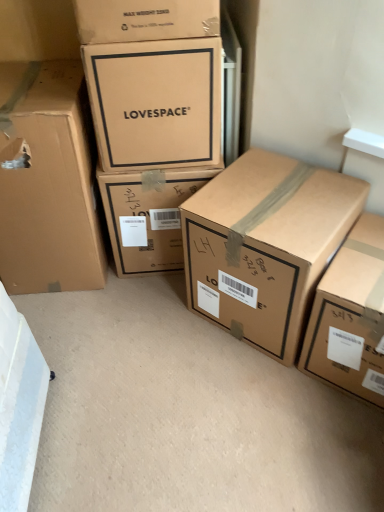
Question: Is point (355, 372) closer or farther from the camera than point (69, 221)?

Choices:
 (A) closer
 (B) farther

Answer: (A)

Question: From a real-world perspective, is brown cardboard box at lower right, which is counted as the first box, starting from the right, positioned above or below matte cardboard box at left, the 5th box in the right-to-left sequence?

Choices:
 (A) below
 (B) above

Answer: (A)

Question: Which object is positioned closest to the matte cardboard box at left, marked as the 1th box in a left-to-right arrangement?

Choices:
 (A) matte cardboard box at upper center, placed as the second box when sorted from left to right
 (B) brown cardboard box at lower right, the 5th box when ordered from left to right
 (C) brown cardboard box at center, which ranks as the 4th box in left-to-right order
 (D) matte cardboard box at center, positioned as the third box in left-to-right order

Answer: (D)

Question: Which object is positioned closest to the brown cardboard box at center, which ranks as the 4th box in left-to-right order?

Choices:
 (A) matte cardboard box at left, marked as the 1th box in a left-to-right arrangement
 (B) matte cardboard box at center, the 3th box in the right-to-left sequence
 (C) matte cardboard box at upper center, placed as the second box when sorted from left to right
 (D) brown cardboard box at lower right, which is counted as the first box, starting from the right

Answer: (D)